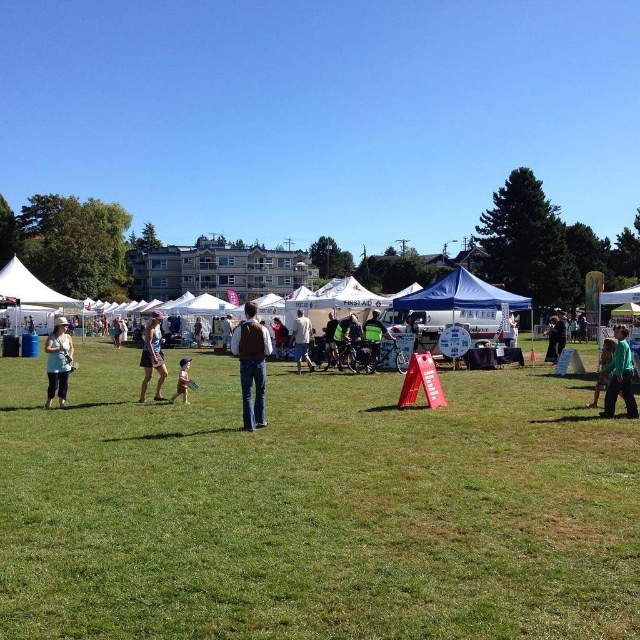
Question: Among these points, which one is farthest from the camera?

Choices:
 (A) (596, 388)
 (B) (60, 296)

Answer: (B)

Question: Is green grassy field at center positioned before brown suede jacket at center?

Choices:
 (A) no
 (B) yes

Answer: (B)

Question: Can you confirm if green grassy field at center is bigger than brown suede jacket at center?

Choices:
 (A) no
 (B) yes

Answer: (A)

Question: Does matte blue dress at left have a lesser width compared to white cotton shirt at center?

Choices:
 (A) no
 (B) yes

Answer: (A)

Question: Which object is farther from the camera taking this photo?

Choices:
 (A) matte blue dress at left
 (B) green matte shirt at right

Answer: (A)

Question: Which object is closer to the camera taking this photo?

Choices:
 (A) reflective silver helmet at center
 (B) matte black shorts at center
 (C) brown suede jacket at center

Answer: (C)